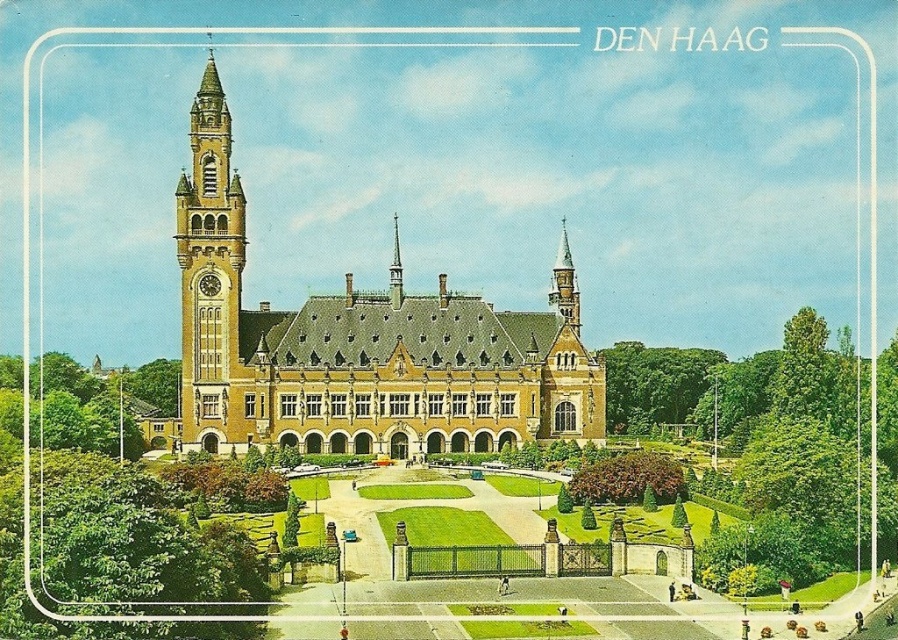
You are a tourist standing in front of the historic building in Den Haag, Netherlands. You see the yellow brick church at left and the golden stone clock tower at left. Which one is positioned more to the right side from your viewpoint?

The yellow brick church at left is positioned more to the right side from your viewpoint compared to the golden stone clock tower at left.

You are a tourist standing in front of the grand historic building in Den Haag. You notice the yellow brick church at left and the golden stone clock tower at left. Which of these two structures is located lower in the image?

The yellow brick church at left is positioned under the golden stone clock tower at left, so it is located lower in the image.

You are an architect visiting the building and want to compare the heights of the golden stone clock tower at left and the polished copper spire at upper right. Based on the scene, which one is taller?

The golden stone clock tower at left is taller than the polished copper spire at upper right according to the description.